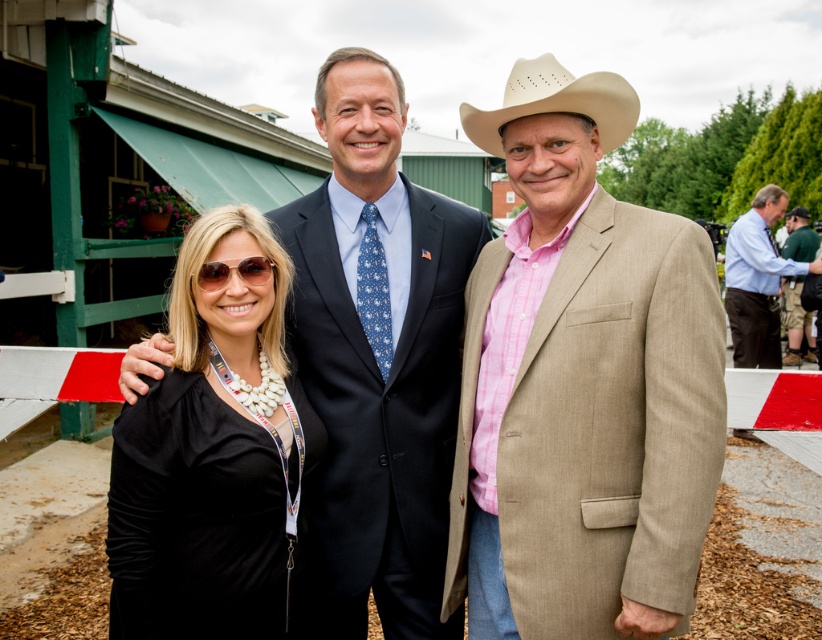
Between tan textured suit at center and blue shirt at center, which one has more height?

blue shirt at center

Consider the image. Is the position of tan textured suit at center less distant than that of blue shirt at center?

Yes, tan textured suit at center is in front of blue shirt at center.

Where is `tan textured suit at center`? tan textured suit at center is located at coordinates (580, 385).

Who is taller, matte black suit at center or green cotton shirt at right?

matte black suit at center

Can you confirm if matte black suit at center is positioned to the right of green cotton shirt at right?

No, matte black suit at center is not to the right of green cotton shirt at right.

Is point (386, 96) farther from camera compared to point (809, 332)?

No.

Locate an element on the screen. The width and height of the screenshot is (822, 640). matte black suit at center is located at coordinates (580, 385).

Can you confirm if black velvet dress at left is smaller than beige felt cowboy hat at right?

Incorrect, black velvet dress at left is not smaller in size than beige felt cowboy hat at right.

Measure the distance between black velvet dress at left and camera.

black velvet dress at left is 6.98 feet away from camera.

The image size is (822, 640). In order to click on black velvet dress at left in this screenshot , I will do `click(213, 451)`.